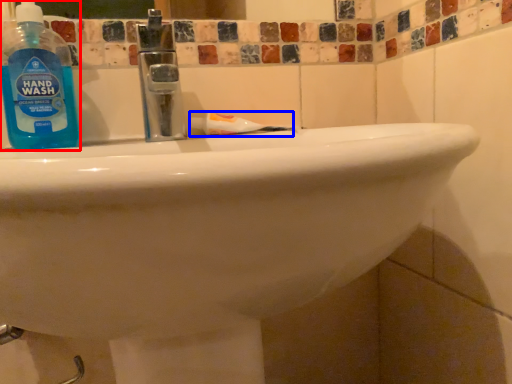
Question: Which of the following is the closest to the observer, cleaning product (highlighted by a red box) or toothpaste (highlighted by a blue box)?

Choices:
 (A) cleaning product
 (B) toothpaste

Answer: (A)